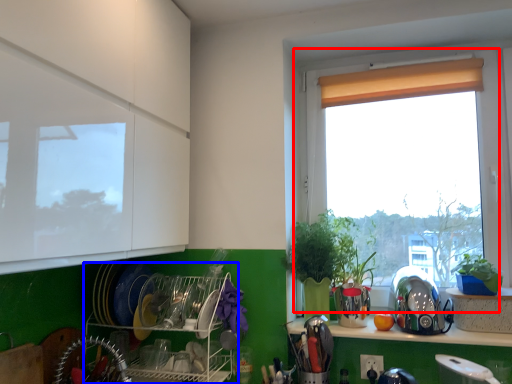
Question: Which of the following is the farthest to the observer, window (highlighted by a red box) or shelf (highlighted by a blue box)?

Choices:
 (A) window
 (B) shelf

Answer: (A)